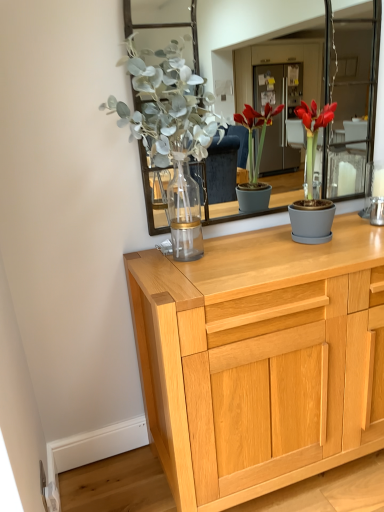
Identify the location of free space in front of matte gray pot at center. The width and height of the screenshot is (384, 512). (326, 253).